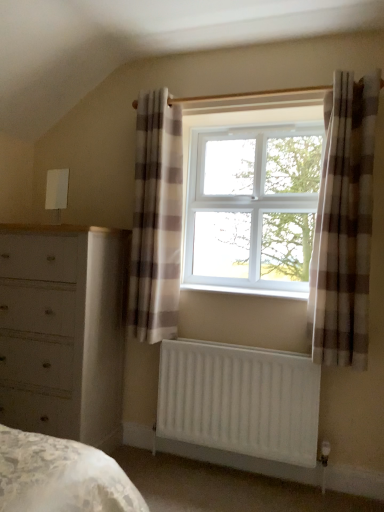
Measure the distance between white matte radiator at lower center and camera.

The depth of white matte radiator at lower center is 2.05 meters.

The height and width of the screenshot is (512, 384). Describe the element at coordinates (239, 400) in the screenshot. I see `white matte radiator at lower center` at that location.

What do you see at coordinates (156, 219) in the screenshot? This screenshot has height=512, width=384. I see `plaid fabric curtain at center, which ranks as the 2th curtain in right-to-left order` at bounding box center [156, 219].

The height and width of the screenshot is (512, 384). What are the coordinates of `white plastic window at center` in the screenshot? It's located at (251, 196).

This screenshot has width=384, height=512. In order to click on white painted wood chest of drawers at left in this screenshot , I will do `click(63, 330)`.

Considering the relative sizes of white matte radiator at lower center and white painted wood chest of drawers at left in the image provided, is white matte radiator at lower center bigger than white painted wood chest of drawers at left?

No, white matte radiator at lower center is not bigger than white painted wood chest of drawers at left.

Are white matte radiator at lower center and white painted wood chest of drawers at left beside each other?

There is a gap between white matte radiator at lower center and white painted wood chest of drawers at left.

Locate an element on the screen. The height and width of the screenshot is (512, 384). radiator below the white painted wood chest of drawers at left (from a real-world perspective) is located at coordinates (239, 400).

Could you measure the distance between white matte radiator at lower center and white painted wood chest of drawers at left?

white matte radiator at lower center and white painted wood chest of drawers at left are 25.80 inches apart from each other.

Which is more to the left, white painted wood chest of drawers at left or white matte radiator at lower center?

From the viewer's perspective, white painted wood chest of drawers at left appears more on the left side.

Considering the positions of point (122, 274) and point (200, 343), is point (122, 274) closer or farther from the camera than point (200, 343)?

Point (122, 274) is positioned farther from the camera compared to point (200, 343).

Are white painted wood chest of drawers at left and white matte radiator at lower center far apart?

white painted wood chest of drawers at left is near white matte radiator at lower center, not far away.

Does white painted wood chest of drawers at left turn towards white matte radiator at lower center?

No, white painted wood chest of drawers at left does not turn towards white matte radiator at lower center.

In the scene shown: From the image's perspective, is white plastic window at center on white plastic window sill at center?

Yes, from the image's perspective, white plastic window at center is above white plastic window sill at center.

Where is `window sill in front of the white plastic window at center`? window sill in front of the white plastic window at center is located at coordinates (248, 291).

In the scene shown: Which is correct: white plastic window at center is inside white plastic window sill at center, or outside of it?

white plastic window at center is not inside white plastic window sill at center, it's outside.

From a real-world perspective, is white plastic window at center physically above white plastic window sill at center?

Yes.

From the picture: Which of these two, white matte radiator at lower center or white plastic window at center, is wider?

white plastic window at center is wider.

Considering the positions of objects white matte radiator at lower center and white plastic window at center in the image provided, who is more to the left, white matte radiator at lower center or white plastic window at center?

white matte radiator at lower center is more to the left.

Is white matte radiator at lower center not close to white plastic window at center?

They are positioned close to each other.

Considering the sizes of white matte radiator at lower center and white plastic window at center in the image, is white matte radiator at lower center bigger or smaller than white plastic window at center?

white matte radiator at lower center is smaller than white plastic window at center.

Based on the photo, who is taller, brown checkered curtain at right, which is counted as the second curtain, starting from the back, or plaid fabric curtain at center, which ranks as the 2th curtain in right-to-left order?

Standing taller between the two is plaid fabric curtain at center, which ranks as the 2th curtain in right-to-left order.

Considering the relative positions of brown checkered curtain at right, placed as the second curtain when sorted from left to right, and plaid fabric curtain at center, which ranks as the 2th curtain in right-to-left order, in the image provided, is brown checkered curtain at right, placed as the second curtain when sorted from left to right, to the left of plaid fabric curtain at center, which ranks as the 2th curtain in right-to-left order, from the viewer's perspective?

No.

Locate an element on the screen. curtain that is behind the brown checkered curtain at right, the first curtain viewed from the front is located at coordinates (156, 219).

Is brown checkered curtain at right, the first curtain viewed from the front, facing away from plaid fabric curtain at center, which appears as the first curtain when viewed from the back?

No, brown checkered curtain at right, the first curtain viewed from the front,'s orientation is not away from plaid fabric curtain at center, which appears as the first curtain when viewed from the back.

Based on their sizes in the image, would you say white painted wood chest of drawers at left is bigger or smaller than brown checkered curtain at right, the first curtain viewed from the front?

white painted wood chest of drawers at left is bigger than brown checkered curtain at right, the first curtain viewed from the front.

Between point (77, 244) and point (315, 239), which one is positioned behind?

Point (77, 244)

From a real-world perspective, count 1st curtains upward from the white painted wood chest of drawers at left and point to it. Please provide its 2D coordinates.

[(344, 225)]

Is white painted wood chest of drawers at left spatially inside brown checkered curtain at right, the first curtain viewed from the front, or outside of it?

white painted wood chest of drawers at left lies outside brown checkered curtain at right, the first curtain viewed from the front.

Considering the sizes of objects white plastic window sill at center and white plastic window at center in the image provided, who is shorter, white plastic window sill at center or white plastic window at center?

With less height is white plastic window sill at center.

Is white plastic window at center a part of white plastic window sill at center?

Definitely not — white plastic window at center is not inside white plastic window sill at center.

From the image's perspective, is white plastic window sill at center above or below white plastic window at center?

white plastic window sill at center is below white plastic window at center.

Considering the relative sizes of white plastic window sill at center and white plastic window at center in the image provided, is white plastic window sill at center bigger than white plastic window at center?

No.

This screenshot has width=384, height=512. I want to click on radiator that is on the right side of white painted wood chest of drawers at left, so click(239, 400).

The height and width of the screenshot is (512, 384). I want to click on chest of drawers above the white matte radiator at lower center (from the image's perspective), so click(x=63, y=330).

Considering their positions, is white plastic window at center positioned closer to plaid fabric curtain at center, the first curtain in the left-to-right sequence, than white painted wood chest of drawers at left?

The object closer to plaid fabric curtain at center, the first curtain in the left-to-right sequence, is white painted wood chest of drawers at left.

From the image, which object appears to be nearer to brown checkered curtain at right, the first curtain from the right, white matte radiator at lower center or white plastic window sill at center?

The object closer to brown checkered curtain at right, the first curtain from the right, is white plastic window sill at center.

Which object lies nearer to the anchor point white plastic window at center, white matte radiator at lower center or white plastic window sill at center?

white plastic window sill at center.

From the image, which object appears to be nearer to white matte radiator at lower center, brown checkered curtain at right, which is counted as the second curtain, starting from the back, or white plastic window sill at center?

Among the two, white plastic window sill at center is located nearer to white matte radiator at lower center.

Considering their positions, is white painted wood chest of drawers at left positioned closer to white plastic window sill at center than white matte radiator at lower center?

white matte radiator at lower center is closer to white plastic window sill at center.

Based on their spatial positions, is white matte radiator at lower center or white plastic window sill at center closer to white painted wood chest of drawers at left?

white matte radiator at lower center lies closer to white painted wood chest of drawers at left than the other object.

Estimate the real-world distances between objects in this image. Which object is further from brown checkered curtain at right, which is counted as the second curtain, starting from the back, plaid fabric curtain at center, the first curtain in the left-to-right sequence, or white matte radiator at lower center?

plaid fabric curtain at center, the first curtain in the left-to-right sequence.

From the image, which object appears to be nearer to white matte radiator at lower center, plaid fabric curtain at center, the second curtain positioned from the front, or white plastic window at center?

The object closer to white matte radiator at lower center is plaid fabric curtain at center, the second curtain positioned from the front.

Identify the location of window sill between white plastic window at center and white matte radiator at lower center from top to bottom. pos(248,291).

This screenshot has width=384, height=512. I want to click on curtain situated between white painted wood chest of drawers at left and white plastic window at center from left to right, so click(156, 219).

This screenshot has width=384, height=512. Identify the location of curtain between white painted wood chest of drawers at left and white plastic window sill at center from left to right. coord(156,219).

At what (x,y) coordinates should I click in order to perform the action: click on window sill between brown checkered curtain at right, placed as the second curtain when sorted from left to right, and white matte radiator at lower center, in the vertical direction. Please return your answer as a coordinate pair (x, y). The height and width of the screenshot is (512, 384). Looking at the image, I should click on (248, 291).